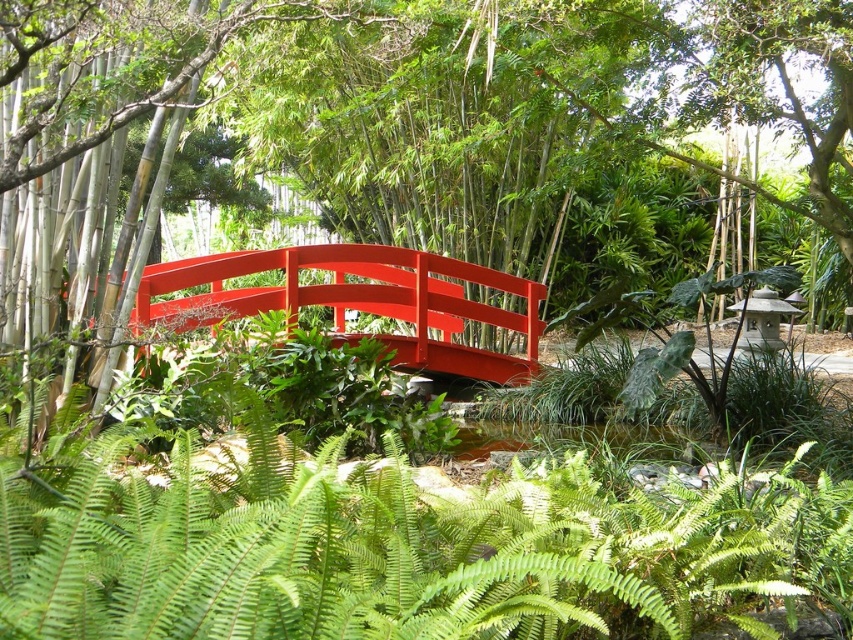
You are standing in the garden and want to take a photo of both the green leafy tree at center and the glossy wood bridge at center. Which object should you focus on first to ensure both are in clear view?

You should focus on the green leafy tree at center first since it is closer to the viewer than the glossy wood bridge at center. By focusing on the closer object, both will be in clear view due to the depth of field.

You are planning to place a decorative statue that is 1 meter wide in the garden. Looking at the image, can the green leafy tree at center and the glossy wood bridge at center accommodate this statue between them?

The green leafy tree at center is wider than the glossy wood bridge at center. However, the exact distance between them isn t specified in the provided information. Without knowing the space between the two objects, it s impossible to determine if the statue will fit.

You are a gardener who needs to water both the green leafy tree at center and the glossy wood bridge at center. If your watering can has a range of 2 meters, can you water both objects without moving closer?

The green leafy tree at center is 2.26 meters away from the glossy wood bridge at center. Since the distance between them is greater than the watering can range of 2 meters, you cannot water both objects without moving closer.